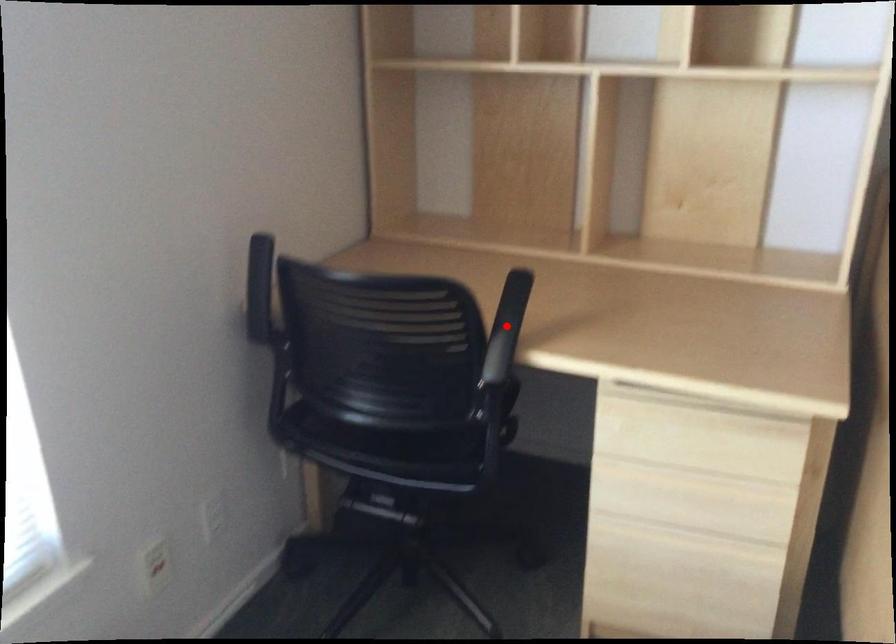
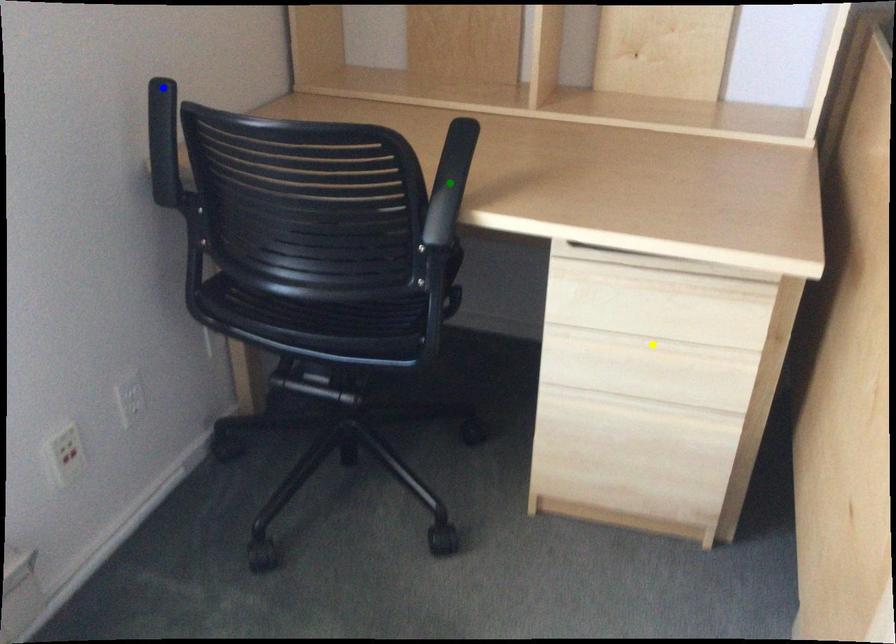
Question: I am providing you with two images of the same scene from different viewpoints. A red point is marked on the first image. You are given multiple points on the second image. Which point in image 2 is actually the same real-world point as the red point in image 1?

Choices:
 (A) green point
 (B) yellow point
 (C) blue point

Answer: (A)